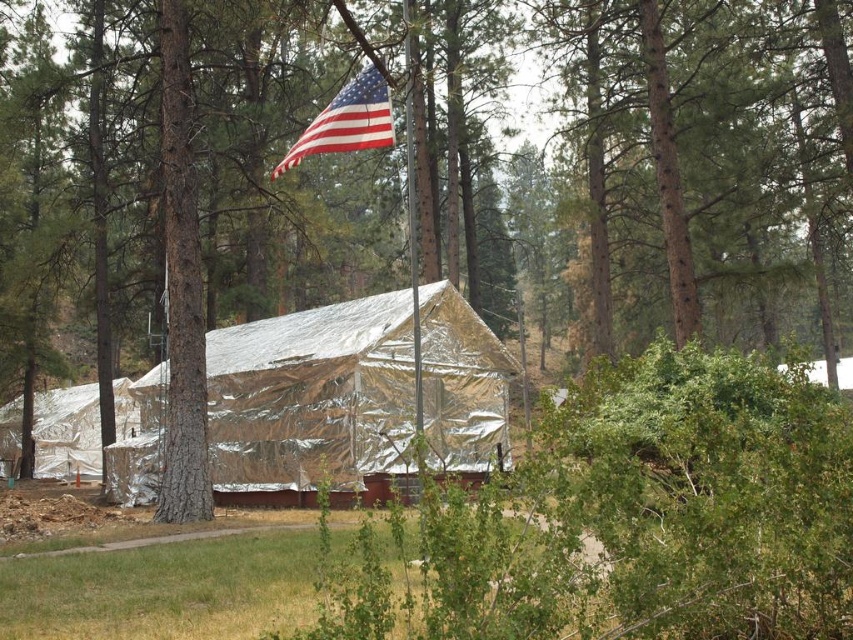
You are a photographer trying to capture both the gold reflective tarp at center and the american flag at upper center in a single frame. Given their sizes, which object will appear bigger in the photo?

The gold reflective tarp at center will appear bigger in the photo because it is larger in size than the american flag at upper center.

You are standing in the forested area shown in the image. There is a point at coordinates (x=67, y=433). What object is this point located on?

The point at coordinates (x=67, y=433) is located on the silver reflective tarp at lower left.

You are a photographer trying to capture both the gold reflective tarp at center and the american flag at upper center in a single frame. Based on their sizes, which object should you focus on first to ensure both fit in the shot?

The gold reflective tarp at center is wider than the american flag at upper center, so you should focus on framing the gold reflective tarp at center first to ensure both objects fit in the shot.